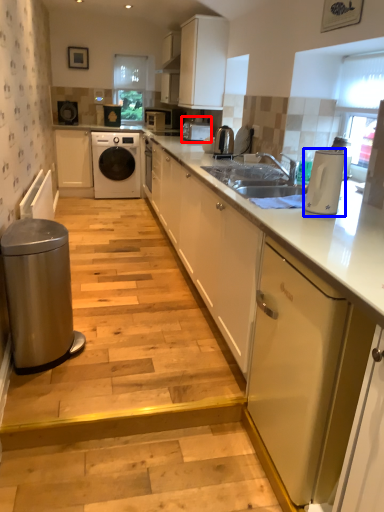
Question: Among these objects, which one is nearest to the camera, appliance (highlighted by a red box) or home appliance (highlighted by a blue box)?

Choices:
 (A) appliance
 (B) home appliance

Answer: (B)